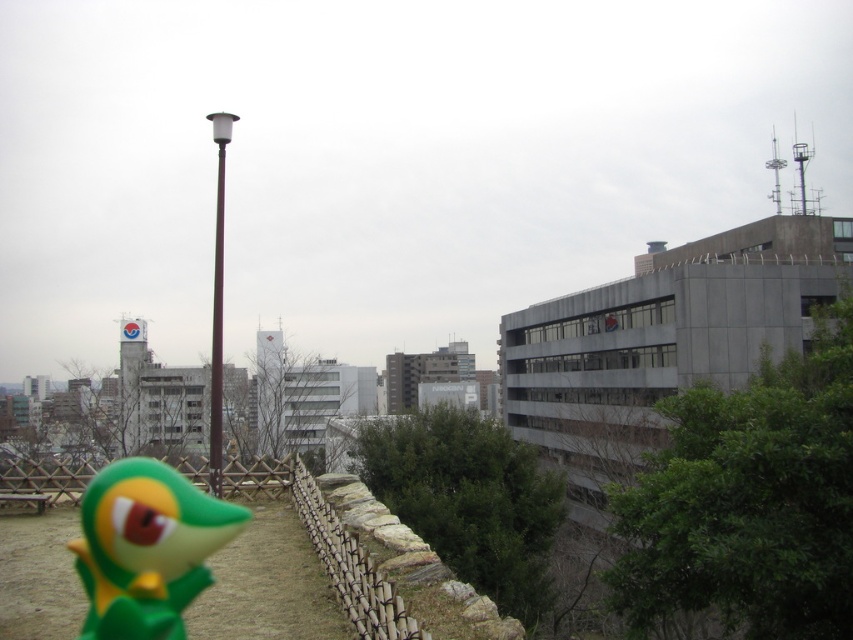
Question: Which of the following is the closest to the observer?

Choices:
 (A) brown polished metal lamp post at center
 (B) smooth brown pole at center

Answer: (B)

Question: Can you confirm if green matte toy at lower left is positioned to the left of brown polished metal lamp post at center?

Choices:
 (A) yes
 (B) no

Answer: (B)

Question: Which of these objects is positioned closest to the smooth brown pole at center?

Choices:
 (A) green matte toy at lower left
 (B) brown polished metal lamp post at center

Answer: (B)

Question: Is brown polished metal lamp post at center positioned at the back of smooth brown pole at center?

Choices:
 (A) no
 (B) yes

Answer: (B)

Question: Which point is closer to the camera?

Choices:
 (A) smooth brown pole at center
 (B) green matte toy at lower left

Answer: (B)

Question: Does green matte toy at lower left appear over smooth brown pole at center?

Choices:
 (A) yes
 (B) no

Answer: (B)